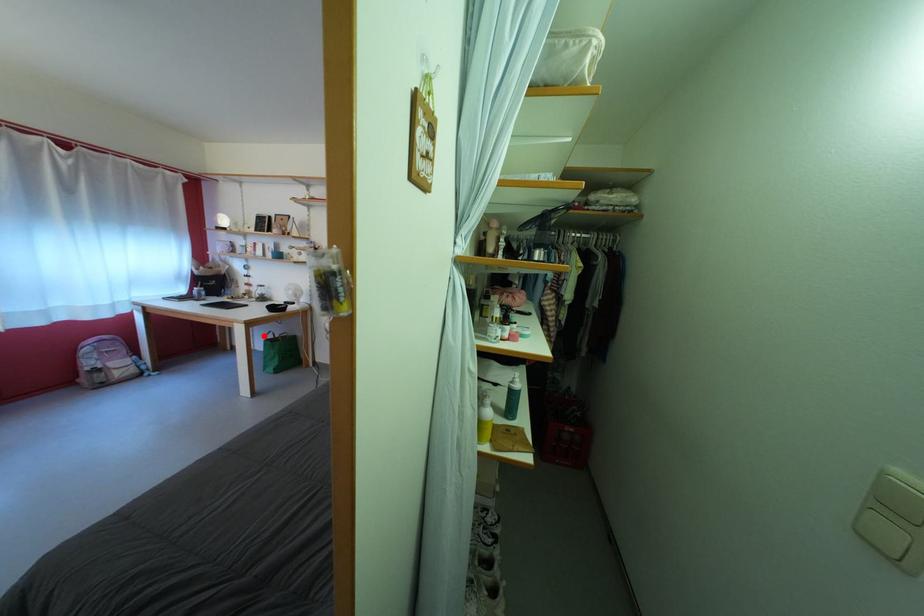
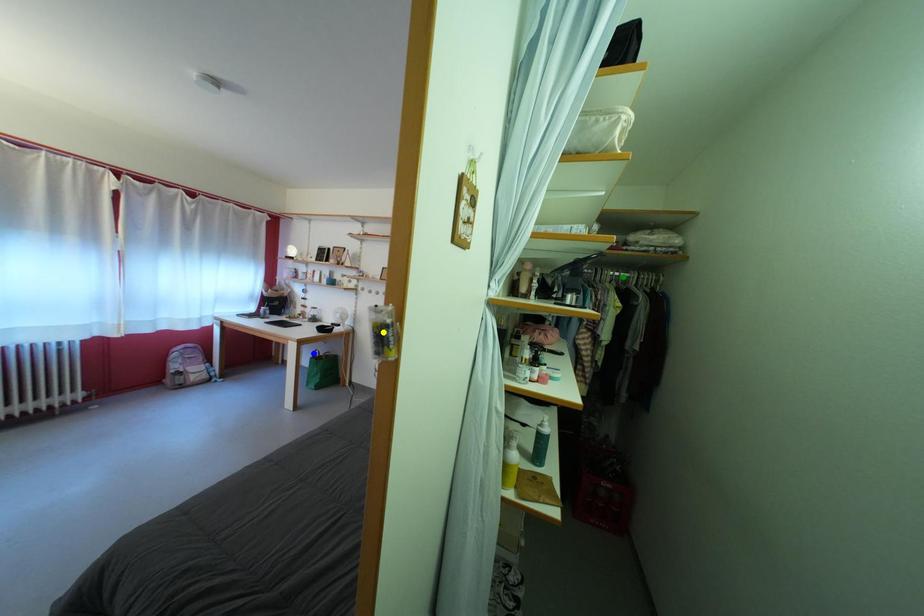
Question: I am providing you with two images of the same scene from different viewpoints. A red point is marked on the first image. You are given multiple points on the second image. Can you choose the point in image 2 that corresponds to the point in image 1?

Choices:
 (A) yellow point
 (B) green point
 (C) blue point

Answer: (C)